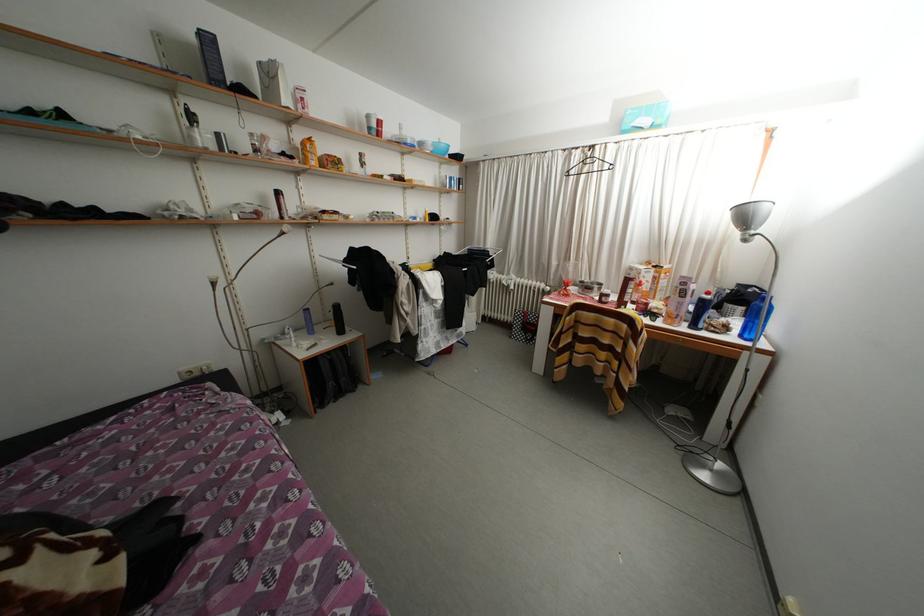
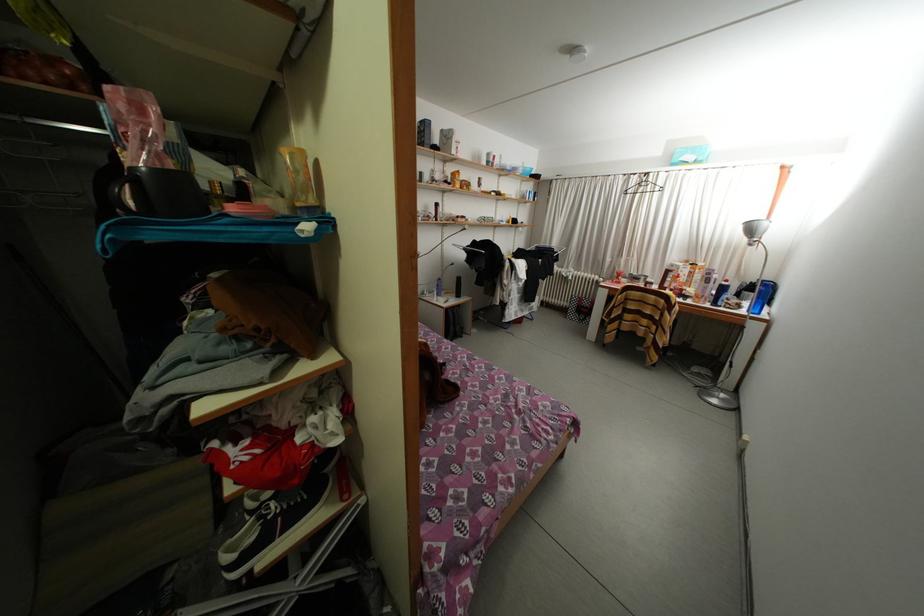
In the second image, find the point that corresponds to (578,159) in the first image.

(638, 184)